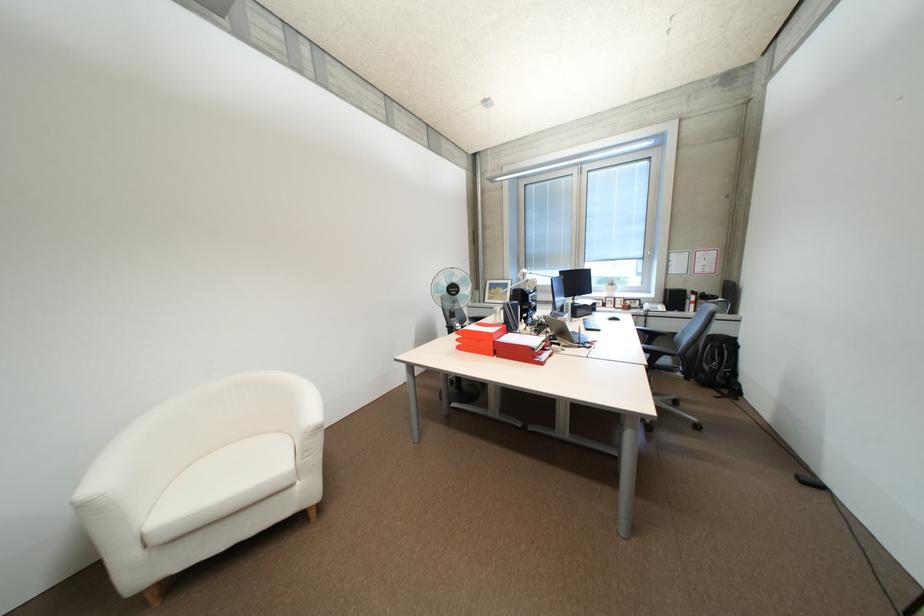
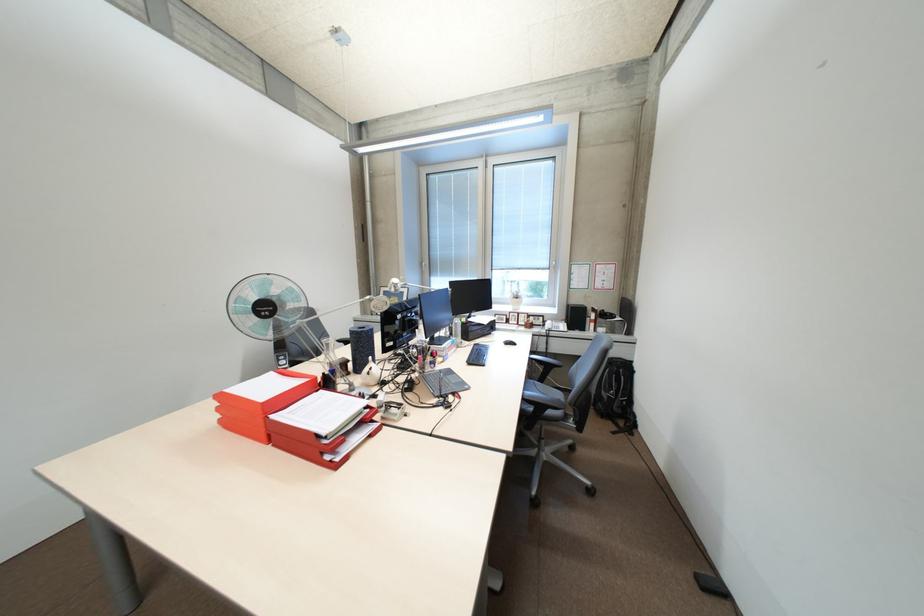
The point at [734,386] is marked in the first image. Where is the corresponding point in the second image?

(630, 416)